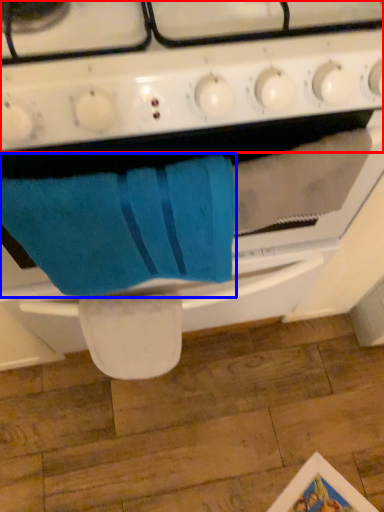
Question: Which object is further to the camera taking this photo, gas stove (highlighted by a red box) or bath towel (highlighted by a blue box)?

Choices:
 (A) gas stove
 (B) bath towel

Answer: (B)